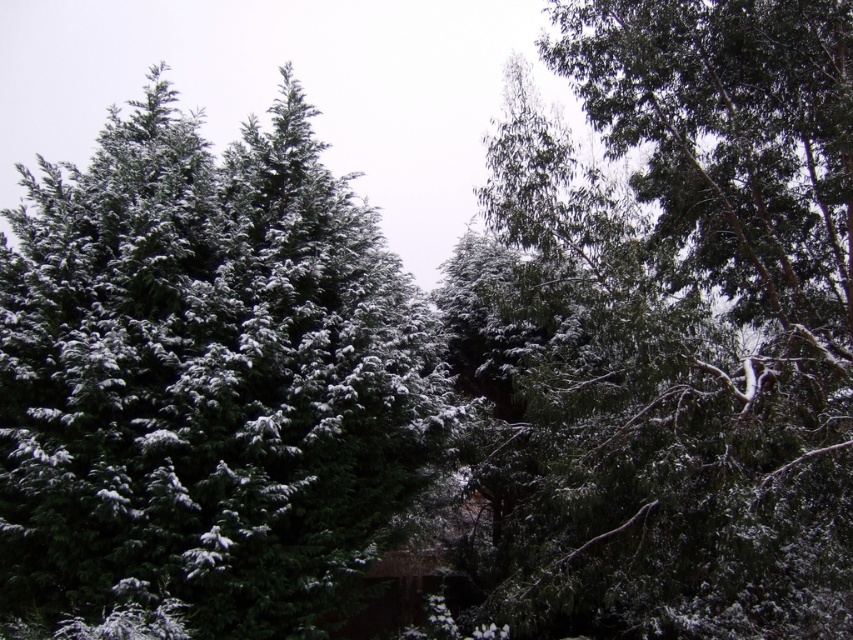
Which is in front, point (654, 346) or point (113, 141)?

Positioned in front is point (654, 346).

Image resolution: width=853 pixels, height=640 pixels. What are the coordinates of `green matte tree at upper center` in the screenshot? It's located at (682, 326).